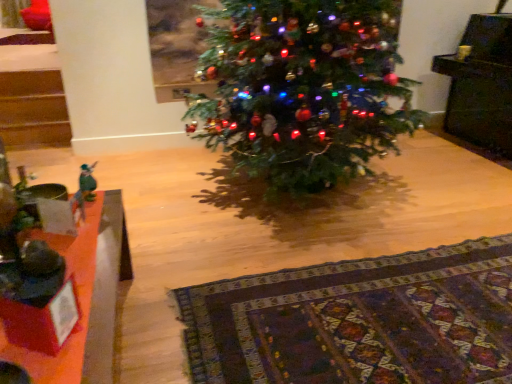
Question: Can you confirm if wooden table at lower left is positioned to the right of patterned wool rug at lower center?

Choices:
 (A) no
 (B) yes

Answer: (A)

Question: Can you confirm if wooden table at lower left is thinner than patterned wool rug at lower center?

Choices:
 (A) yes
 (B) no

Answer: (A)

Question: Is wooden table at lower left at the left side of patterned wool rug at lower center?

Choices:
 (A) no
 (B) yes

Answer: (B)

Question: Is wooden table at lower left outside of patterned wool rug at lower center?

Choices:
 (A) yes
 (B) no

Answer: (A)

Question: From the image's perspective, does wooden table at lower left appear lower than patterned wool rug at lower center?

Choices:
 (A) yes
 (B) no

Answer: (B)

Question: Based on their positions, is green felt angel at left located to the left or right of patterned wool rug at lower center?

Choices:
 (A) right
 (B) left

Answer: (B)

Question: From a real-world perspective, is green felt angel at left above or below patterned wool rug at lower center?

Choices:
 (A) below
 (B) above

Answer: (B)

Question: Looking at the image, does green felt angel at left seem bigger or smaller compared to patterned wool rug at lower center?

Choices:
 (A) small
 (B) big

Answer: (A)

Question: Is green felt angel at left taller or shorter than patterned wool rug at lower center?

Choices:
 (A) short
 (B) tall

Answer: (B)

Question: From the image's perspective, is wooden table at lower left positioned above or below green matte christmas tree at center?

Choices:
 (A) above
 (B) below

Answer: (B)

Question: In terms of height, does wooden table at lower left look taller or shorter compared to green matte christmas tree at center?

Choices:
 (A) short
 (B) tall

Answer: (A)

Question: Considering the positions of point (100, 269) and point (248, 153), is point (100, 269) closer or farther from the camera than point (248, 153)?

Choices:
 (A) farther
 (B) closer

Answer: (B)

Question: Is wooden table at lower left wider or thinner than green matte christmas tree at center?

Choices:
 (A) thin
 (B) wide

Answer: (A)

Question: Considering the positions of point (272, 29) and point (281, 288), is point (272, 29) closer or farther from the camera than point (281, 288)?

Choices:
 (A) farther
 (B) closer

Answer: (A)

Question: From a real-world perspective, is green matte christmas tree at center positioned above or below patterned wool rug at lower center?

Choices:
 (A) above
 (B) below

Answer: (A)